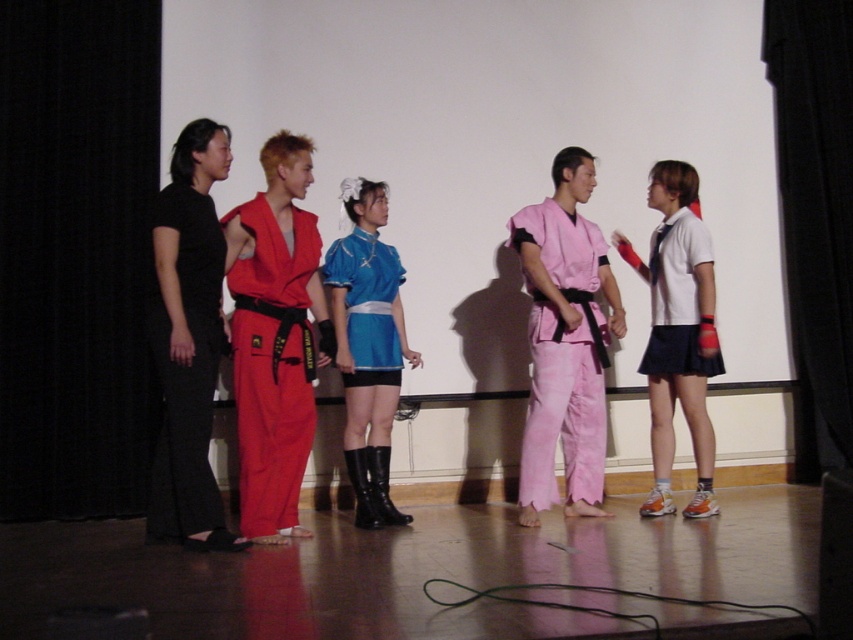
From the picture: Based on the scene description, which object is positioned to the right of the other between the white matte shirt at right and the shiny blue fabric dress at center?

The white matte shirt at right is positioned to the right of the shiny blue fabric dress at center.